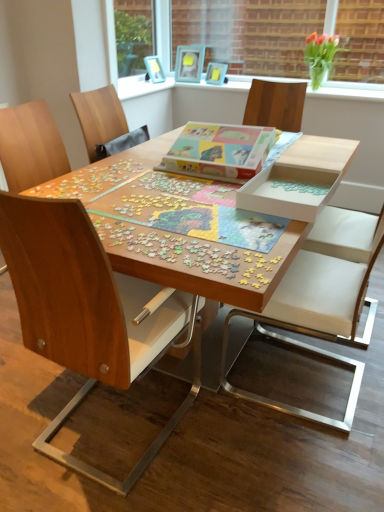
How much space does white leather chair at center, marked as the first chair in a right-to-left arrangement, occupy horizontally?

white leather chair at center, marked as the first chair in a right-to-left arrangement, is 65.03 centimeters wide.

What do you see at coordinates (84, 312) in the screenshot? I see `wooden chair at left, the second chair from the right` at bounding box center [84, 312].

Locate an element on the screen. The width and height of the screenshot is (384, 512). wooden photo frame at upper center, the 2th picture frame in the left-to-right sequence is located at coordinates (189, 63).

What is the approximate width of green glass vase at upper right?

25.89 centimeters.

The height and width of the screenshot is (512, 384). I want to click on green glass vase at upper right, so click(320, 56).

What do you see at coordinates (220, 151) in the screenshot? This screenshot has height=512, width=384. I see `multicolored cardboard jigsaw puzzle at center, the 1th jigsaw puzzle in the top-to-bottom sequence` at bounding box center [220, 151].

The width and height of the screenshot is (384, 512). What are the coordinates of `matte plastic picture frame at upper center, the third picture frame positioned from the left` in the screenshot? It's located at (216, 73).

Identify the location of white leather chair at center, marked as the first chair in a right-to-left arrangement. This screenshot has height=512, width=384. (321, 298).

Visually, is wooden photo frame at upper center, the second picture frame viewed from the right, positioned to the left or to the right of clear glass vase at upper center?

Clearly, wooden photo frame at upper center, the second picture frame viewed from the right, is on the left of clear glass vase at upper center in the image.

Can you confirm if wooden photo frame at upper center, the 2th picture frame in the left-to-right sequence, is taller than clear glass vase at upper center?

No.

Is wooden photo frame at upper center, the second picture frame viewed from the right, bigger than clear glass vase at upper center?

No, wooden photo frame at upper center, the second picture frame viewed from the right, is not bigger than clear glass vase at upper center.

Considering the positions of objects wooden photo frame at upper center, the second picture frame viewed from the right, and clear glass vase at upper center in the image provided, who is in front, wooden photo frame at upper center, the second picture frame viewed from the right, or clear glass vase at upper center?

clear glass vase at upper center is closer to the camera.

Image resolution: width=384 pixels, height=512 pixels. I want to click on window screen that is in front of the matte blue picture frame at upper center, the third picture frame viewed from the right, so point(254,36).

Between clear glass vase at upper center and matte blue picture frame at upper center, the third picture frame viewed from the right, which one has larger width?

With larger width is matte blue picture frame at upper center, the third picture frame viewed from the right.

Considering the points (267, 67) and (155, 61), which point is in front, point (267, 67) or point (155, 61)?

Positioned in front is point (155, 61).

Considering the positions of point (153, 141) and point (355, 376), is point (153, 141) closer or farther from the camera than point (355, 376)?

Point (153, 141) is farther from the camera than point (355, 376).

Where is `the 1st chair in front of the wooden puzzle at center`? the 1st chair in front of the wooden puzzle at center is located at coordinates (321, 298).

Between wooden puzzle at center and white leather chair at center, marked as the first chair in a right-to-left arrangement, which one has smaller width?

white leather chair at center, marked as the first chair in a right-to-left arrangement.

Would you consider wooden puzzle at center to be distant from white leather chair at center, marked as the first chair in a right-to-left arrangement?

wooden puzzle at center is actually quite close to white leather chair at center, marked as the first chair in a right-to-left arrangement.

Is wooden photo frame at upper center, the second picture frame viewed from the right, to the right of wooden puzzle pieces at center, which is the second jigsaw puzzle from top to bottom, from the viewer's perspective?

Incorrect, wooden photo frame at upper center, the second picture frame viewed from the right, is not on the right side of wooden puzzle pieces at center, which is the second jigsaw puzzle from top to bottom.

Is wooden photo frame at upper center, the 2th picture frame in the left-to-right sequence, looking in the opposite direction of wooden puzzle pieces at center, which is the second jigsaw puzzle from top to bottom?

wooden photo frame at upper center, the 2th picture frame in the left-to-right sequence, is not turned away from wooden puzzle pieces at center, which is the second jigsaw puzzle from top to bottom.

From a real-world perspective, is wooden photo frame at upper center, the 2th picture frame in the left-to-right sequence, on wooden puzzle pieces at center, which is the second jigsaw puzzle from top to bottom?

Yes, from a real-world perspective, wooden photo frame at upper center, the 2th picture frame in the left-to-right sequence, is on top of wooden puzzle pieces at center, which is the second jigsaw puzzle from top to bottom.

Considering the positions of point (175, 68) and point (258, 274), is point (175, 68) closer or farther from the camera than point (258, 274)?

Point (175, 68) is positioned farther from the camera compared to point (258, 274).

Considering the relative sizes of matte plastic picture frame at upper center, the third picture frame positioned from the left, and wooden chair at left, the second chair from the right, in the image provided, is matte plastic picture frame at upper center, the third picture frame positioned from the left, bigger than wooden chair at left, the second chair from the right,?

Result: Incorrect, matte plastic picture frame at upper center, the third picture frame positioned from the left, is not larger than wooden chair at left, the second chair from the right.

Considering the sizes of matte plastic picture frame at upper center, which is counted as the first picture frame, starting from the right, and wooden chair at left, positioned as the first chair in left-to-right order, in the image, is matte plastic picture frame at upper center, which is counted as the first picture frame, starting from the right, taller or shorter than wooden chair at left, positioned as the first chair in left-to-right order,?

Considering their sizes, matte plastic picture frame at upper center, which is counted as the first picture frame, starting from the right, has less height than wooden chair at left, positioned as the first chair in left-to-right order.

Looking at this image, how many degrees apart are the facing directions of matte plastic picture frame at upper center, the third picture frame positioned from the left, and wooden chair at left, the second chair from the right?

The angular difference between matte plastic picture frame at upper center, the third picture frame positioned from the left, and wooden chair at left, the second chair from the right, is 153 degrees.

Between wooden photo frame at upper center, the second picture frame viewed from the right, and matte plastic picture frame at upper center, which is counted as the first picture frame, starting from the right, which one has smaller size?

matte plastic picture frame at upper center, which is counted as the first picture frame, starting from the right.

Are wooden photo frame at upper center, the second picture frame viewed from the right, and matte plastic picture frame at upper center, which is counted as the first picture frame, starting from the right, located far from each other?

No, wooden photo frame at upper center, the second picture frame viewed from the right, is not far from matte plastic picture frame at upper center, which is counted as the first picture frame, starting from the right.

Considering the sizes of wooden photo frame at upper center, the second picture frame viewed from the right, and matte plastic picture frame at upper center, the third picture frame positioned from the left, in the image, is wooden photo frame at upper center, the second picture frame viewed from the right, wider or thinner than matte plastic picture frame at upper center, the third picture frame positioned from the left,?

Clearly, wooden photo frame at upper center, the second picture frame viewed from the right, has less width compared to matte plastic picture frame at upper center, the third picture frame positioned from the left.

Is point (197, 61) closer or farther from the camera than point (219, 70)?

Point (197, 61).

The width and height of the screenshot is (384, 512). Identify the location of window screen above the wooden chair at left, positioned as the first chair in left-to-right order (from the image's perspective). (254, 36).

Who is more distant, wooden chair at left, positioned as the first chair in left-to-right order, or clear glass vase at upper center?

clear glass vase at upper center is more distant.

Is wooden chair at left, positioned as the first chair in left-to-right order, positioned with its back to clear glass vase at upper center?

wooden chair at left, positioned as the first chair in left-to-right order, does not have its back to clear glass vase at upper center.

From the image's perspective, does wooden chair at left, the second chair from the right, appear lower than clear glass vase at upper center?

Correct, wooden chair at left, the second chair from the right, appears lower than clear glass vase at upper center in the image.

From a real-world perspective, which picture frame is the 1st one underneath the clear glass vase at upper center? Please provide its 2D coordinates.

[(189, 63)]

Where is `window screen that is in front of the matte blue picture frame at upper center, the third picture frame viewed from the right`? window screen that is in front of the matte blue picture frame at upper center, the third picture frame viewed from the right is located at coordinates (254, 36).

Based on the photo, considering their positions, is multicolored cardboard jigsaw puzzle at center, the 1th jigsaw puzzle in the top-to-bottom sequence, positioned further to wooden puzzle at center than white leather chair at center, marked as the first chair in a right-to-left arrangement?

white leather chair at center, marked as the first chair in a right-to-left arrangement.

When comparing their distances from wooden chair at left, positioned as the first chair in left-to-right order, does multicolored cardboard jigsaw puzzle at center, the 2th jigsaw puzzle in the bottom-to-top sequence, or wooden puzzle at center seem further?

multicolored cardboard jigsaw puzzle at center, the 2th jigsaw puzzle in the bottom-to-top sequence, is positioned further to the anchor wooden chair at left, positioned as the first chair in left-to-right order.

In the scene shown: Looking at the image, which one is located closer to multicolored cardboard jigsaw puzzle at center, the 1th jigsaw puzzle in the top-to-bottom sequence, wooden chair at left, the second chair from the right, or clear glass vase at upper center?

Based on the image, wooden chair at left, the second chair from the right, appears to be nearer to multicolored cardboard jigsaw puzzle at center, the 1th jigsaw puzzle in the top-to-bottom sequence.

When comparing their distances from white leather chair at center, which is the 2th chair in left-to-right order, does matte plastic picture frame at upper center, the third picture frame positioned from the left, or wooden photo frame at upper center, the 2th picture frame in the left-to-right sequence, seem further?

wooden photo frame at upper center, the 2th picture frame in the left-to-right sequence, lies further to white leather chair at center, which is the 2th chair in left-to-right order, than the other object.

Looking at the image, which one is located closer to clear glass vase at upper center, wooden chair at left, the second chair from the right, or wooden puzzle pieces at center, which is the second jigsaw puzzle from top to bottom?

wooden puzzle pieces at center, which is the second jigsaw puzzle from top to bottom.

Which object lies further to the anchor point wooden puzzle at center, wooden chair at left, positioned as the first chair in left-to-right order, or clear glass vase at upper center?

clear glass vase at upper center lies further to wooden puzzle at center than the other object.

Considering their positions, is wooden photo frame at upper center, the 2th picture frame in the left-to-right sequence, positioned further to green glass vase at upper right than white leather chair at center, which is the 2th chair in left-to-right order?

Based on the image, white leather chair at center, which is the 2th chair in left-to-right order, appears to be further to green glass vase at upper right.

Estimate the real-world distances between objects in this image. Which object is further from white leather chair at center, marked as the first chair in a right-to-left arrangement, matte blue picture frame at upper center, the third picture frame viewed from the right, or wooden photo frame at upper center, the 2th picture frame in the left-to-right sequence?

Among the two, matte blue picture frame at upper center, the third picture frame viewed from the right, is located further to white leather chair at center, marked as the first chair in a right-to-left arrangement.

This screenshot has height=512, width=384. In order to click on flower between wooden puzzle pieces at center, the first jigsaw puzzle ordered from the bottom, and clear glass vase at upper center from front to back in this screenshot , I will do `click(320, 56)`.

The width and height of the screenshot is (384, 512). In order to click on picture frame between wooden puzzle at center and matte blue picture frame at upper center, the third picture frame viewed from the right, from front to back in this screenshot , I will do `click(216, 73)`.

Identify the location of flower between white leather chair at center, marked as the first chair in a right-to-left arrangement, and wooden photo frame at upper center, the second picture frame viewed from the right, along the z-axis. The height and width of the screenshot is (512, 384). (320, 56).

Identify the location of window screen located between wooden chair at left, the second chair from the right, and wooden photo frame at upper center, the 2th picture frame in the left-to-right sequence, in the depth direction. (254, 36).